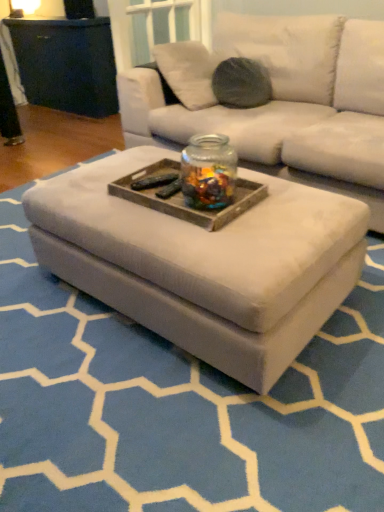
The image size is (384, 512). What do you see at coordinates (182, 196) in the screenshot?
I see `wooden tray at center` at bounding box center [182, 196].

This screenshot has width=384, height=512. I want to click on white fabric ottoman at center, so click(x=205, y=264).

The height and width of the screenshot is (512, 384). Describe the element at coordinates (208, 172) in the screenshot. I see `transparent glass jar at center` at that location.

Locate an element on the screen. Image resolution: width=384 pixels, height=512 pixels. wooden tray at center is located at coordinates (182, 196).

Are transparent glass jar at center and white fabric ottoman at center located far from each other?

transparent glass jar at center is near white fabric ottoman at center, not far away.

Which point is more distant from viewer, (220, 195) or (285, 273)?

The point (220, 195) is farther.

Can you tell me how much transparent glass jar at center and white fabric ottoman at center differ in facing direction?

The angular difference between transparent glass jar at center and white fabric ottoman at center is 179 degrees.

Considering the sizes of objects transparent glass jar at center and white fabric ottoman at center in the image provided, who is wider, transparent glass jar at center or white fabric ottoman at center?

With larger width is white fabric ottoman at center.

Does white fabric ottoman at center have a lesser height compared to wooden tray at center?

In fact, white fabric ottoman at center may be taller than wooden tray at center.

How distant is white fabric ottoman at center from wooden tray at center?

white fabric ottoman at center is 7.94 inches away from wooden tray at center.

From a real-world perspective, is white fabric ottoman at center physically above wooden tray at center?

No, from a real-world perspective, white fabric ottoman at center is not above wooden tray at center.

Considering the relative sizes of white fabric ottoman at center and wooden tray at center in the image provided, is white fabric ottoman at center thinner than wooden tray at center?

In fact, white fabric ottoman at center might be wider than wooden tray at center.

From a real-world perspective, is wooden tray at center over transparent glass jar at center?

Actually, wooden tray at center is physically below transparent glass jar at center in the real world.

From the image's perspective, is wooden tray at center on top of transparent glass jar at center?

No, from the image's perspective, wooden tray at center is not on top of transparent glass jar at center.

Are wooden tray at center and transparent glass jar at center located far from each other?

Actually, wooden tray at center and transparent glass jar at center are a little close together.

What's the angular difference between wooden tray at center and transparent glass jar at center's facing directions?

0.00138 degrees separate the facing orientations of wooden tray at center and transparent glass jar at center.

Where is `tray that is behind the transparent glass jar at center`? The width and height of the screenshot is (384, 512). tray that is behind the transparent glass jar at center is located at coordinates (182, 196).

Could you tell me if transparent glass jar at center is turned towards wooden tray at center?

No, transparent glass jar at center is not turned towards wooden tray at center.

Looking at their sizes, would you say transparent glass jar at center is wider or thinner than wooden tray at center?

In the image, transparent glass jar at center appears to be more narrow than wooden tray at center.

Which object is thinner, white fabric ottoman at center or transparent glass jar at center?

transparent glass jar at center is thinner.

Does white fabric ottoman at center touch transparent glass jar at center?

No, white fabric ottoman at center is not making contact with transparent glass jar at center.

Which object is further away from the camera taking this photo, white fabric ottoman at center or transparent glass jar at center?

transparent glass jar at center.

From a real-world perspective, which is physically above, white fabric ottoman at center or transparent glass jar at center?

transparent glass jar at center is physically above.

In the image, is wooden tray at center on the left side or the right side of white fabric ottoman at center?

In the image, wooden tray at center appears on the right side of white fabric ottoman at center.

Does wooden tray at center turn towards white fabric ottoman at center?

No.

Consider the image. Which of these two, wooden tray at center or white fabric ottoman at center, is smaller?

wooden tray at center is smaller.

Would you say wooden tray at center is inside or outside white fabric ottoman at center?

wooden tray at center lies outside white fabric ottoman at center.

Locate an element on the screen. The width and height of the screenshot is (384, 512). glass jar on the right of white fabric ottoman at center is located at coordinates (208, 172).

Locate an element on the screen. The height and width of the screenshot is (512, 384). tray that appears above the white fabric ottoman at center (from the image's perspective) is located at coordinates (182, 196).

Estimate the real-world distances between objects in this image. Which object is further from wooden tray at center, transparent glass jar at center or white fabric ottoman at center?

white fabric ottoman at center is positioned further to the anchor wooden tray at center.

From the image, which object appears to be nearer to white fabric ottoman at center, wooden tray at center or transparent glass jar at center?

The object closer to white fabric ottoman at center is wooden tray at center.

From the image, which object appears to be nearer to transparent glass jar at center, wooden tray at center or white fabric ottoman at center?

The object closer to transparent glass jar at center is wooden tray at center.

Which object lies nearer to the anchor point transparent glass jar at center, white fabric ottoman at center or wooden tray at center?

wooden tray at center.

Which object lies nearer to the anchor point white fabric ottoman at center, transparent glass jar at center or wooden tray at center?

Based on the image, wooden tray at center appears to be nearer to white fabric ottoman at center.

Estimate the real-world distances between objects in this image. Which object is further from wooden tray at center, white fabric ottoman at center or transparent glass jar at center?

white fabric ottoman at center.

You are a GUI agent. You are given a task and a screenshot of the screen. Output one action in this format:
    pyautogui.click(x=<x>, y=<y>)
    Task: Click on the glass jar positioned between white fabric ottoman at center and wooden tray at center from near to far
    The width and height of the screenshot is (384, 512).
    Given the screenshot: What is the action you would take?
    pyautogui.click(x=208, y=172)